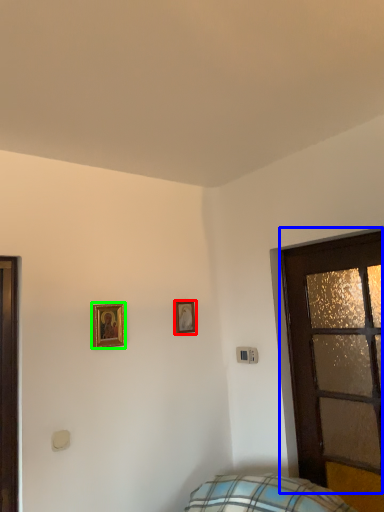
Question: Which object is positioned farthest from picture frame (highlighted by a red box)? Select from door (highlighted by a blue box) and picture frame (highlighted by a green box).

Choices:
 (A) door
 (B) picture frame

Answer: (A)